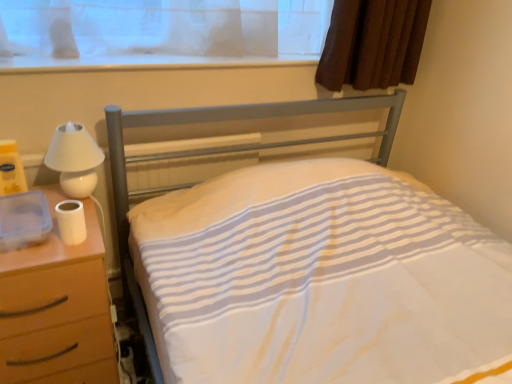
Looking at this image, what is the approximate width of white striped fabric at center?

white striped fabric at center is 3.65 feet in width.

The width and height of the screenshot is (512, 384). What do you see at coordinates (219, 153) in the screenshot?
I see `white striped fabric at center` at bounding box center [219, 153].

What is the approximate width of white glossy lamp at left?

It is 13.48 centimeters.

The height and width of the screenshot is (384, 512). What do you see at coordinates (71, 222) in the screenshot? I see `white matte toilet paper at left` at bounding box center [71, 222].

The width and height of the screenshot is (512, 384). I want to click on white striped fabric at center, so click(x=219, y=153).

Looking at this image, is white glossy lamp at left positioned far away from white matte toilet paper at left?

No.

The width and height of the screenshot is (512, 384). I want to click on toilet paper below the white glossy lamp at left (from the image's perspective), so click(x=71, y=222).

From their relative heights in the image, would you say white glossy lamp at left is taller or shorter than white matte toilet paper at left?

Clearly, white glossy lamp at left is taller compared to white matte toilet paper at left.

Between point (98, 155) and point (57, 215), which one is positioned in front?

The point (57, 215) is closer to the camera.

Is the depth of white matte nightstand at left greater than that of white plastic window sill at upper center?

No, it is in front of white plastic window sill at upper center.

From their relative heights in the image, would you say white matte nightstand at left is taller or shorter than white plastic window sill at upper center?

white matte nightstand at left is taller than white plastic window sill at upper center.

Consider the image. Which object is thinner, white matte nightstand at left or white plastic window sill at upper center?

white plastic window sill at upper center is thinner.

Locate an element on the screen. The image size is (512, 384). bed below the white glossy lamp at left (from a real-world perspective) is located at coordinates (219, 153).

Which of these two, white glossy lamp at left or white striped fabric at center, is bigger?

Bigger between the two is white striped fabric at center.

From the image's perspective, would you say white glossy lamp at left is shown under white striped fabric at center?

Incorrect, from the image's perspective, white glossy lamp at left is higher than white striped fabric at center.

In terms of width, does white glossy lamp at left look wider or thinner when compared to white striped fabric at center?

In the image, white glossy lamp at left appears to be more narrow than white striped fabric at center.

Considering the relative positions of white plastic window sill at upper center and white glossy lamp at left in the image provided, is white plastic window sill at upper center behind white glossy lamp at left?

Yes, white plastic window sill at upper center is further from the viewer.

Is white plastic window sill at upper center far from white glossy lamp at left?

No.

This screenshot has height=384, width=512. Identify the location of window sill on the right side of white glossy lamp at left. (145, 62).

Could you tell me if white plastic window sill at upper center is turned towards white glossy lamp at left?

No, white plastic window sill at upper center is not aimed at white glossy lamp at left.

Considering the sizes of objects white striped fabric at center and white matte nightstand at left in the image provided, who is smaller, white striped fabric at center or white matte nightstand at left?

white matte nightstand at left is smaller.

Is white matte nightstand at left a part of white striped fabric at center?

No.

In the scene shown: In terms of width, does white striped fabric at center look wider or thinner when compared to white matte nightstand at left?

Clearly, white striped fabric at center has more width compared to white matte nightstand at left.

Is white matte toilet paper at left to the right of white glossy lamp at left from the viewer's perspective?

Indeed, white matte toilet paper at left is positioned on the right side of white glossy lamp at left.

Can you tell me how much white matte toilet paper at left and white glossy lamp at left differ in facing direction?

white matte toilet paper at left and white glossy lamp at left are facing 0.00729 degrees away from each other.

Is white matte toilet paper at left far away from white glossy lamp at left?

No, white matte toilet paper at left is in close proximity to white glossy lamp at left.

From a real-world perspective, does white matte toilet paper at left sit lower than white glossy lamp at left?

Yes, from a real-world perspective, white matte toilet paper at left is beneath white glossy lamp at left.

Is white matte toilet paper at left located outside white matte nightstand at left?

Yes, white matte toilet paper at left is located beyond the bounds of white matte nightstand at left.

From the image's perspective, which is below, white matte toilet paper at left or white matte nightstand at left?

From the image's view, white matte nightstand at left is below.

Does white matte toilet paper at left turn towards white matte nightstand at left?

No, white matte toilet paper at left is not aimed at white matte nightstand at left.

I want to click on lamp on the left of the white matte toilet paper at left, so 74,159.

What are the coordinates of `window sill that appears on the right of white matte nightstand at left` in the screenshot? It's located at (145, 62).

Based on their spatial positions, is white matte nightstand at left or white matte toilet paper at left further from white plastic window sill at upper center?

Based on the image, white matte nightstand at left appears to be further to white plastic window sill at upper center.

When comparing their distances from white striped fabric at center, does white matte toilet paper at left or white matte nightstand at left seem closer?

white matte nightstand at left is positioned closer to the anchor white striped fabric at center.

When comparing their distances from white matte toilet paper at left, does white matte nightstand at left or white glossy lamp at left seem further?

white matte nightstand at left.

From the image, which object appears to be farther from white matte toilet paper at left, white striped fabric at center or white matte nightstand at left?

white striped fabric at center.

Based on their spatial positions, is white matte nightstand at left or white plastic window sill at upper center further from white striped fabric at center?

Among the two, white matte nightstand at left is located further to white striped fabric at center.

From the image, which object appears to be farther from white matte toilet paper at left, white glossy lamp at left or white matte nightstand at left?

white matte nightstand at left is further to white matte toilet paper at left.

Estimate the real-world distances between objects in this image. Which object is further from white striped fabric at center, white glossy lamp at left or white matte toilet paper at left?

Among the two, white matte toilet paper at left is located further to white striped fabric at center.

Based on the photo, based on their spatial positions, is white glossy lamp at left or white matte nightstand at left further from white striped fabric at center?

Among the two, white glossy lamp at left is located further to white striped fabric at center.

Where is `toilet paper between white matte nightstand at left and white striped fabric at center in the horizontal direction`? Image resolution: width=512 pixels, height=384 pixels. toilet paper between white matte nightstand at left and white striped fabric at center in the horizontal direction is located at coordinates (71, 222).

Locate an element on the screen. The image size is (512, 384). toilet paper between white glossy lamp at left and white striped fabric at center is located at coordinates click(71, 222).

Identify the location of toilet paper between white glossy lamp at left and white matte nightstand at left in the vertical direction. (71, 222).

The height and width of the screenshot is (384, 512). Find the location of `toilet paper between white plastic window sill at upper center and white striped fabric at center from top to bottom`. toilet paper between white plastic window sill at upper center and white striped fabric at center from top to bottom is located at coordinates (71, 222).